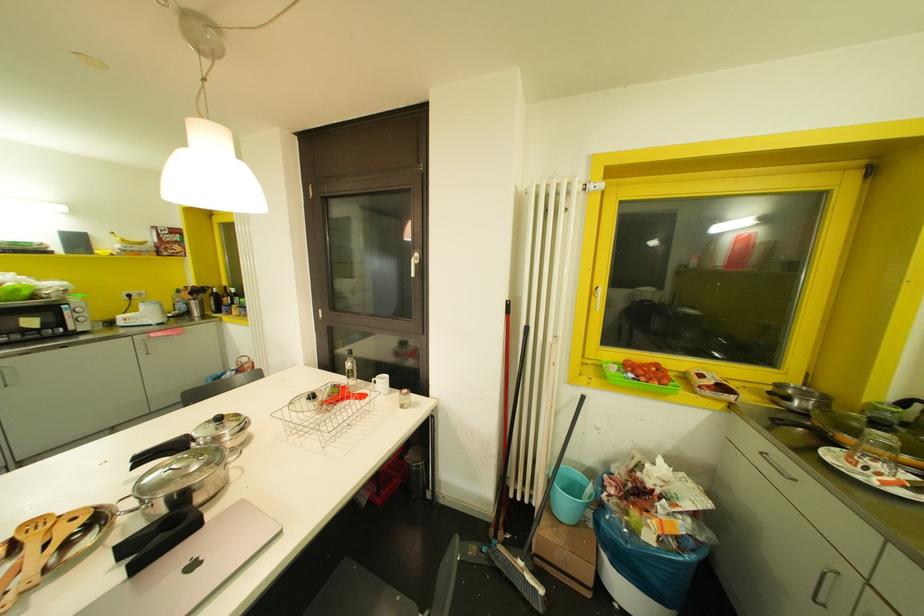
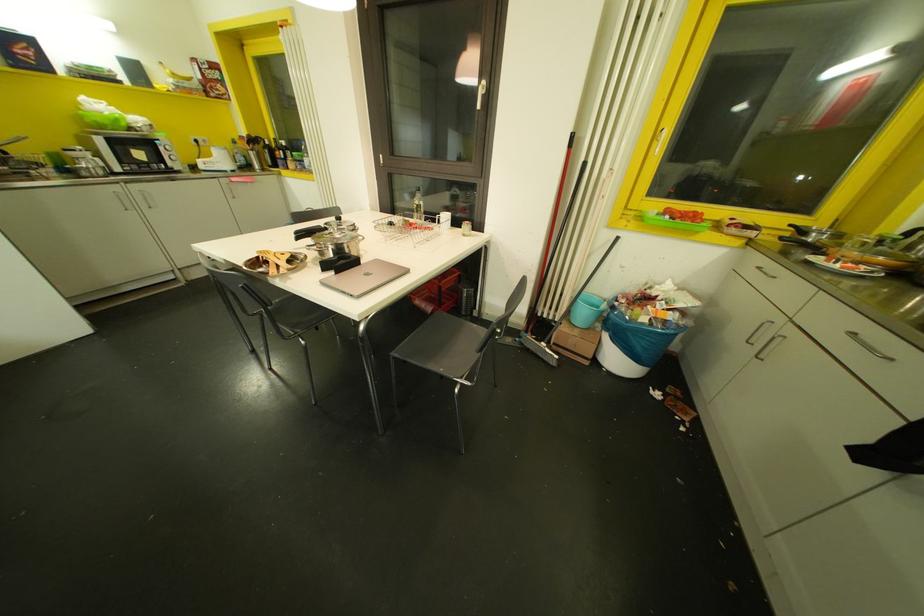
The images are taken continuously from a first-person perspective. In which direction are you moving?

The cameraman moved toward left, backward.